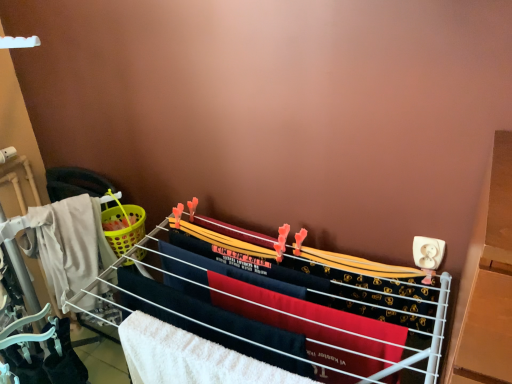
Question: Considering the positions of point (181, 342) and point (434, 347), is point (181, 342) closer or farther from the camera than point (434, 347)?

Choices:
 (A) farther
 (B) closer

Answer: (A)

Question: Looking at their shapes, would you say white fluffy beach towel at center is wider or thinner than white fabric drying rack at center?

Choices:
 (A) thin
 (B) wide

Answer: (A)

Question: In the image, is white fluffy beach towel at center positioned in front of or behind white fabric drying rack at center?

Choices:
 (A) front
 (B) behind

Answer: (B)

Question: From a real-world perspective, is white fabric drying rack at center physically located above or below white fluffy beach towel at center?

Choices:
 (A) below
 (B) above

Answer: (A)

Question: Considering the positions of white fabric drying rack at center and white fluffy beach towel at center in the image, is white fabric drying rack at center wider or thinner than white fluffy beach towel at center?

Choices:
 (A) wide
 (B) thin

Answer: (A)

Question: Is white fabric drying rack at center to the left or to the right of white fluffy beach towel at center in the image?

Choices:
 (A) left
 (B) right

Answer: (B)

Question: In terms of size, does white fabric drying rack at center appear bigger or smaller than white fluffy beach towel at center?

Choices:
 (A) big
 (B) small

Answer: (A)